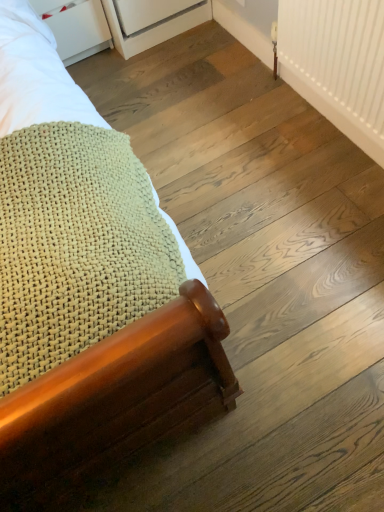
This screenshot has width=384, height=512. I want to click on white matte drawer at upper left, so click(x=76, y=27).

From the picture: Measure the distance between point (162, 330) and camera.

The depth of point (162, 330) is 22.80 inches.

Where is `white matte drawer at upper left`? white matte drawer at upper left is located at coordinates (76, 27).

You are a GUI agent. You are given a task and a screenshot of the screen. Output one action in this format:
    pyautogui.click(x=<x>, y=<y>)
    Task: Click on the radiator that is on the right side of wooden bed frame at lower left
    This screenshot has height=512, width=384.
    Given the screenshot: What is the action you would take?
    pyautogui.click(x=337, y=63)

Are white plastic radiator at upper right and wooden bed frame at lower left making contact?

white plastic radiator at upper right and wooden bed frame at lower left are clearly separated.

Consider the image. Is white plastic radiator at upper right wider than wooden bed frame at lower left?

No.

Between white plastic radiator at upper right and wooden bed frame at lower left, which one has smaller size?

white plastic radiator at upper right is smaller.

Which is less distant, (355,138) or (80,54)?

Point (355,138) appears to be closer to the viewer than point (80,54).

From the image's perspective, is white plastic radiator at upper right positioned above or below white matte drawer at upper left?

white plastic radiator at upper right is below white matte drawer at upper left.

Which of these two, white plastic radiator at upper right or white matte drawer at upper left, stands shorter?

Standing shorter between the two is white matte drawer at upper left.

Is wooden bed frame at lower left positioned with its back to white plastic radiator at upper right?

No, white plastic radiator at upper right is not at the back of wooden bed frame at lower left.

Which is behind, point (108, 130) or point (377, 93)?

The point (377, 93) is farther from the camera.

From a real-world perspective, is wooden bed frame at lower left located higher than white plastic radiator at upper right?

Yes.

Can you confirm if wooden bed frame at lower left is positioned to the left of white plastic radiator at upper right?

Indeed, wooden bed frame at lower left is positioned on the left side of white plastic radiator at upper right.

Based on the photo, considering the relative sizes of wooden bed frame at lower left and white matte drawer at upper left in the image provided, is wooden bed frame at lower left thinner than white matte drawer at upper left?

Incorrect, the width of wooden bed frame at lower left is not less than that of white matte drawer at upper left.

How far apart are wooden bed frame at lower left and white matte drawer at upper left?

A distance of 38.76 inches exists between wooden bed frame at lower left and white matte drawer at upper left.

Which of these two, wooden bed frame at lower left or white matte drawer at upper left, stands shorter?

Standing shorter between the two is white matte drawer at upper left.

Is wooden bed frame at lower left at the left side of white matte drawer at upper left?

Yes.

Does white matte drawer at upper left have a larger size compared to white plastic radiator at upper right?

Yes, white matte drawer at upper left is bigger than white plastic radiator at upper right.

Can you tell me how much white matte drawer at upper left and white plastic radiator at upper right differ in facing direction?

There is a 90-degree angle between the facing directions of white matte drawer at upper left and white plastic radiator at upper right.

Between white matte drawer at upper left and white plastic radiator at upper right, which one appears on the left side from the viewer's perspective?

Positioned to the left is white matte drawer at upper left.

From the image's perspective, between white matte drawer at upper left and wooden bed frame at lower left, which one is located above?

From the image's view, white matte drawer at upper left is above.

Is wooden bed frame at lower left inside white matte drawer at upper left?

No, wooden bed frame at lower left is not surrounded by white matte drawer at upper left.

Image resolution: width=384 pixels, height=512 pixels. I want to click on drawer located on the right of wooden bed frame at lower left, so click(x=76, y=27).

The height and width of the screenshot is (512, 384). Identify the location of radiator lying above the wooden bed frame at lower left (from the image's perspective). (337, 63).

This screenshot has width=384, height=512. I want to click on drawer that is behind the white plastic radiator at upper right, so click(x=76, y=27).

Based on their spatial positions, is white plastic radiator at upper right or white matte drawer at upper left closer to wooden bed frame at lower left?

Among the two, white plastic radiator at upper right is located nearer to wooden bed frame at lower left.

Estimate the real-world distances between objects in this image. Which object is closer to white plastic radiator at upper right, white matte drawer at upper left or wooden bed frame at lower left?

Based on the image, wooden bed frame at lower left appears to be nearer to white plastic radiator at upper right.

Estimate the real-world distances between objects in this image. Which object is closer to wooden bed frame at lower left, white matte drawer at upper left or white plastic radiator at upper right?

white plastic radiator at upper right lies closer to wooden bed frame at lower left than the other object.

From the image, which object appears to be farther from white matte drawer at upper left, white plastic radiator at upper right or wooden bed frame at lower left?

white plastic radiator at upper right is positioned further to the anchor white matte drawer at upper left.

Considering their positions, is wooden bed frame at lower left positioned further to white plastic radiator at upper right than white matte drawer at upper left?

white matte drawer at upper left is further to white plastic radiator at upper right.

When comparing their distances from white matte drawer at upper left, does wooden bed frame at lower left or white plastic radiator at upper right seem further?

white plastic radiator at upper right lies further to white matte drawer at upper left than the other object.

Where is `radiator located between wooden bed frame at lower left and white matte drawer at upper left in the depth direction`? The image size is (384, 512). radiator located between wooden bed frame at lower left and white matte drawer at upper left in the depth direction is located at coordinates (337, 63).